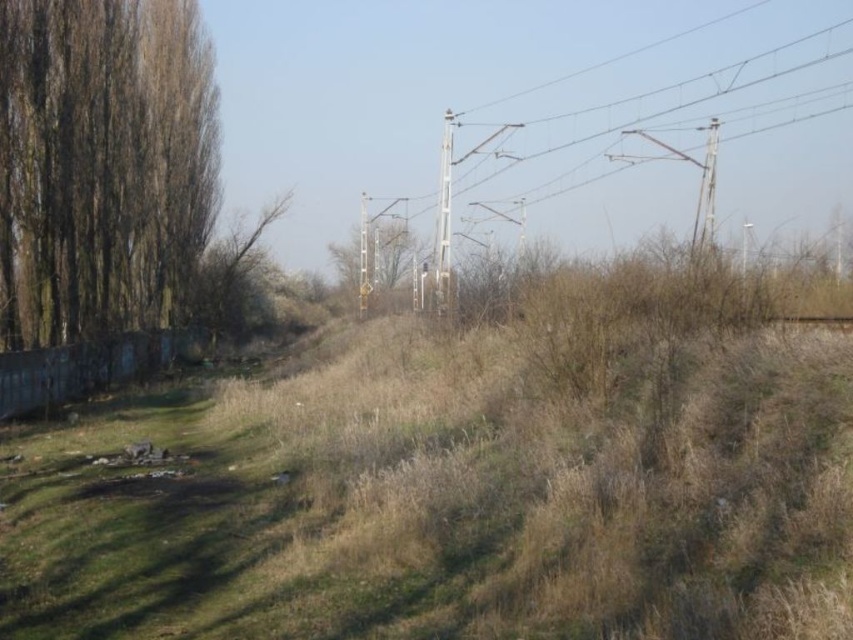
Does brown rough bark tree at left appear under green matte signpost at center?

Actually, brown rough bark tree at left is above green matte signpost at center.

Where is `brown rough bark tree at left`? The height and width of the screenshot is (640, 853). brown rough bark tree at left is located at coordinates (102, 164).

Locate an element on the screen. The height and width of the screenshot is (640, 853). brown rough bark tree at left is located at coordinates (102, 164).

At what (x,y) coordinates should I click in order to perform the action: click on dry grass at center. Please return your answer as a coordinate pair (x, y). The width and height of the screenshot is (853, 640). Looking at the image, I should click on (447, 506).

You are a GUI agent. You are given a task and a screenshot of the screen. Output one action in this format:
    pyautogui.click(x=<x>, y=<y>)
    Task: Click on the dry grass at center
    This screenshot has height=640, width=853.
    Given the screenshot: What is the action you would take?
    pyautogui.click(x=447, y=506)

Between brown rough bark tree at left and green leafy tree at left, which one has less height?

With less height is green leafy tree at left.

Which of these two, brown rough bark tree at left or green leafy tree at left, stands taller?

Standing taller between the two is brown rough bark tree at left.

Is point (35, 42) behind point (235, 326)?

No, it is in front of (235, 326).

Find the location of a particular element. This screenshot has height=640, width=853. brown rough bark tree at left is located at coordinates (102, 164).